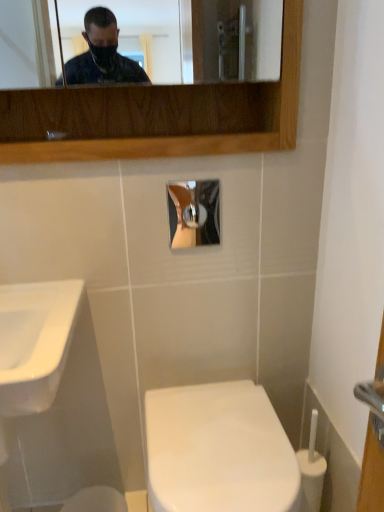
Question: Would you consider white glossy toilet bowl at lower center to be distant from white glossy toilet at center?

Choices:
 (A) yes
 (B) no

Answer: (B)

Question: From the image's perspective, would you say white glossy toilet bowl at lower center is positioned over white glossy toilet at center?

Choices:
 (A) yes
 (B) no

Answer: (B)

Question: Considering the relative sizes of white glossy toilet bowl at lower center and white glossy toilet at center in the image provided, is white glossy toilet bowl at lower center wider than white glossy toilet at center?

Choices:
 (A) yes
 (B) no

Answer: (B)

Question: From the image's perspective, does white glossy toilet bowl at lower center appear lower than white glossy toilet at center?

Choices:
 (A) yes
 (B) no

Answer: (A)

Question: Is white glossy toilet bowl at lower center directly adjacent to white glossy toilet at center?

Choices:
 (A) no
 (B) yes

Answer: (A)

Question: Can white glossy toilet at center be found inside white glossy toilet bowl at lower center?

Choices:
 (A) no
 (B) yes

Answer: (A)

Question: Is matte silver faucet at upper center thinner than white glossy toilet bowl at lower center?

Choices:
 (A) yes
 (B) no

Answer: (A)

Question: Does matte silver faucet at upper center have a greater height compared to white glossy toilet bowl at lower center?

Choices:
 (A) no
 (B) yes

Answer: (A)

Question: Is matte silver faucet at upper center behind white glossy toilet bowl at lower center?

Choices:
 (A) no
 (B) yes

Answer: (A)

Question: Does matte silver faucet at upper center appear on the left side of white glossy toilet bowl at lower center?

Choices:
 (A) no
 (B) yes

Answer: (B)

Question: Is matte silver faucet at upper center facing towards white glossy toilet bowl at lower center?

Choices:
 (A) no
 (B) yes

Answer: (A)

Question: Is matte silver faucet at upper center positioned beyond the bounds of white glossy toilet bowl at lower center?

Choices:
 (A) yes
 (B) no

Answer: (A)

Question: Is white glossy toilet at center outside of matte silver faucet at upper center?

Choices:
 (A) yes
 (B) no

Answer: (A)